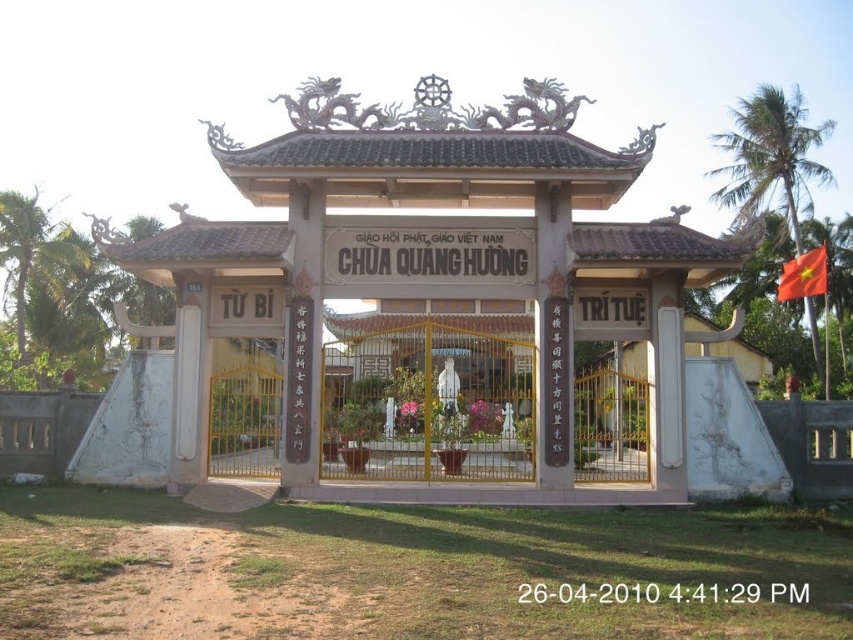
Question: Does white stone gazebo at center appear on the left side of red fabric flag at upper right?

Choices:
 (A) no
 (B) yes

Answer: (B)

Question: Which object is farther from the camera taking this photo?

Choices:
 (A) red fabric flag at upper right
 (B) metallic gate at center

Answer: (A)

Question: Is metallic gate at center below red fabric flag at upper right?

Choices:
 (A) no
 (B) yes

Answer: (B)

Question: Is white stone gazebo at center bigger than metallic gate at center?

Choices:
 (A) yes
 (B) no

Answer: (A)

Question: Which point is farther to the camera?

Choices:
 (A) metallic gate at center
 (B) white stone gazebo at center
 (C) red fabric flag at upper right

Answer: (C)

Question: Which object is closer to the camera taking this photo?

Choices:
 (A) white stone gazebo at center
 (B) red fabric flag at upper right

Answer: (A)